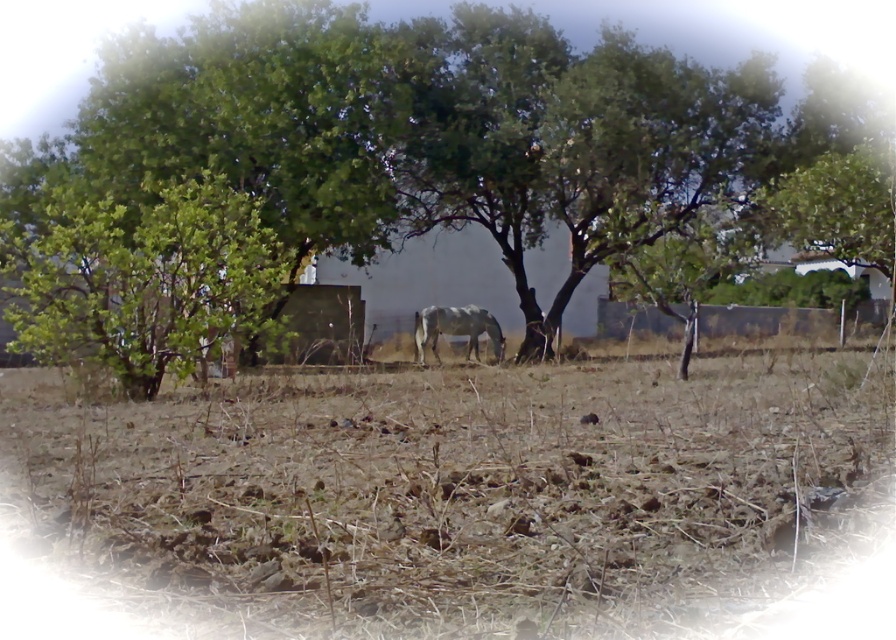
From the picture: You are a farmer standing at the edge of the field. You notice the green leafy tree at center and the gray matte horse at center. How far apart are these two objects from each other?

The green leafy tree at center is 32.26 feet from the gray matte horse at center.

You are a farmer checking the condition of your field. You notice the brown dry dirt at center and the green leafy tree at center. Which one takes up more space in the image?

The green leafy tree at center takes up more space in the image because it is larger than the brown dry dirt at center.